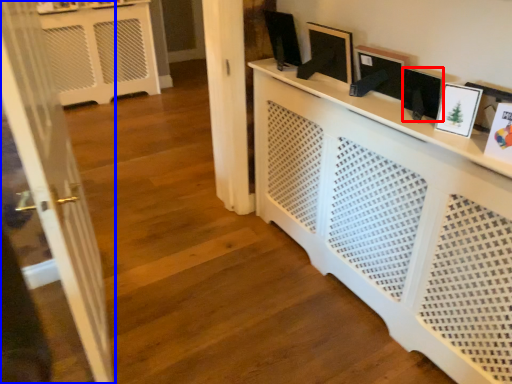
Question: Which object is further to the camera taking this photo, picture frame (highlighted by a red box) or door (highlighted by a blue box)?

Choices:
 (A) picture frame
 (B) door

Answer: (A)